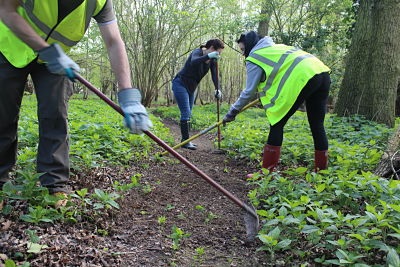
Where is `small plants`? small plants is located at coordinates (306, 193), (338, 189), (367, 216), (333, 222), (109, 198), (43, 214), (175, 236), (95, 151), (100, 125), (245, 143).